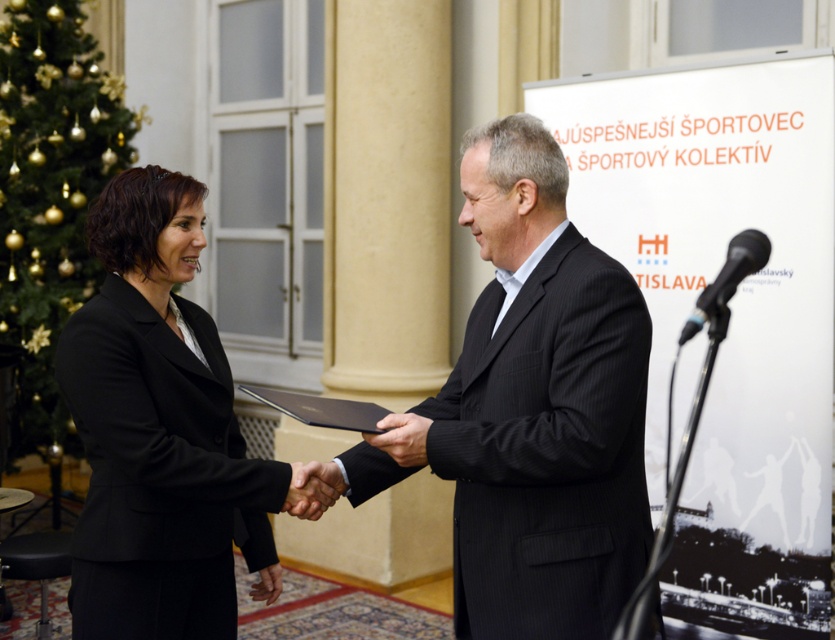
Question: Which point appears farthest from the camera in this image?

Choices:
 (A) (726, 272)
 (B) (163, 563)

Answer: (B)

Question: Does black plastic microphone at right come behind matte black hand at center?

Choices:
 (A) yes
 (B) no

Answer: (B)

Question: From the image, what is the correct spatial relationship of black pinstripe suit at center in relation to black matte suit at center?

Choices:
 (A) left
 (B) right

Answer: (B)

Question: Is the position of black pinstripe suit at center less distant than that of black leather hand at center?

Choices:
 (A) no
 (B) yes

Answer: (B)

Question: Which point appears closest to the camera in this image?

Choices:
 (A) (746, 257)
 (B) (405, 435)
 (C) (281, 570)
 (D) (87, 234)

Answer: (A)

Question: Considering the real-world distances, which object is closest to the black plastic microphone at right?

Choices:
 (A) matte black hand at center
 (B) black leather hand at center

Answer: (A)